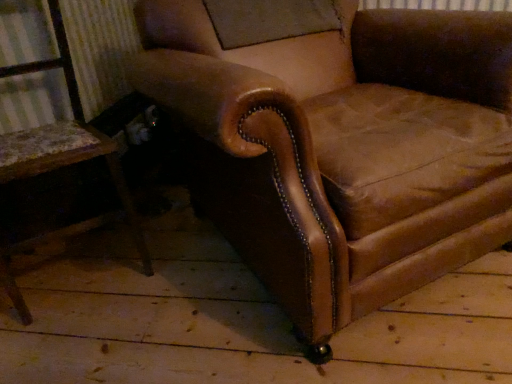
Question: From a real-world perspective, is brown leather armchair at center, acting as the 1th chair starting from the right, located higher than brown leather chair at left, the 2th chair when ordered from right to left?

Choices:
 (A) yes
 (B) no

Answer: (B)

Question: Is brown leather armchair at center, the 2th chair in the left-to-right sequence, completely or partially outside of brown leather chair at left, the first chair when ordered from left to right?

Choices:
 (A) no
 (B) yes

Answer: (B)

Question: From a real-world perspective, does brown leather armchair at center, acting as the 1th chair starting from the right, sit lower than brown leather chair at left, the first chair when ordered from left to right?

Choices:
 (A) yes
 (B) no

Answer: (A)

Question: Is brown leather armchair at center, acting as the 1th chair starting from the right, aimed at brown leather chair at left, the first chair when ordered from left to right?

Choices:
 (A) no
 (B) yes

Answer: (A)

Question: Is brown leather armchair at center, acting as the 1th chair starting from the right, further to camera compared to brown leather chair at left, the first chair when ordered from left to right?

Choices:
 (A) no
 (B) yes

Answer: (A)

Question: Considering the relative sizes of brown leather armchair at center, acting as the 1th chair starting from the right, and brown leather chair at left, the first chair when ordered from left to right, in the image provided, is brown leather armchair at center, acting as the 1th chair starting from the right, taller than brown leather chair at left, the first chair when ordered from left to right,?

Choices:
 (A) no
 (B) yes

Answer: (A)

Question: Is brown leather chair at left, the first chair when ordered from left to right, positioned before brown leather armchair at center, acting as the 1th chair starting from the right?

Choices:
 (A) yes
 (B) no

Answer: (B)

Question: Does brown leather chair at left, the 2th chair when ordered from right to left, have a lesser width compared to brown leather armchair at center, the 2th chair in the left-to-right sequence?

Choices:
 (A) no
 (B) yes

Answer: (B)

Question: From a real-world perspective, is brown leather chair at left, the first chair when ordered from left to right, under brown leather armchair at center, the 2th chair in the left-to-right sequence?

Choices:
 (A) yes
 (B) no

Answer: (B)

Question: Would you say brown leather chair at left, the 2th chair when ordered from right to left, is a long distance from brown leather armchair at center, acting as the 1th chair starting from the right?

Choices:
 (A) yes
 (B) no

Answer: (B)

Question: From the image's perspective, is brown leather chair at left, the 2th chair when ordered from right to left, beneath brown leather armchair at center, acting as the 1th chair starting from the right?

Choices:
 (A) no
 (B) yes

Answer: (B)

Question: Can you confirm if brown leather chair at left, the 2th chair when ordered from right to left, is wider than brown leather armchair at center, the 2th chair in the left-to-right sequence?

Choices:
 (A) yes
 (B) no

Answer: (B)

Question: Is brown leather armchair at center, acting as the 1th chair starting from the right, taller or shorter than brown leather chair at left, the 2th chair when ordered from right to left?

Choices:
 (A) short
 (B) tall

Answer: (A)